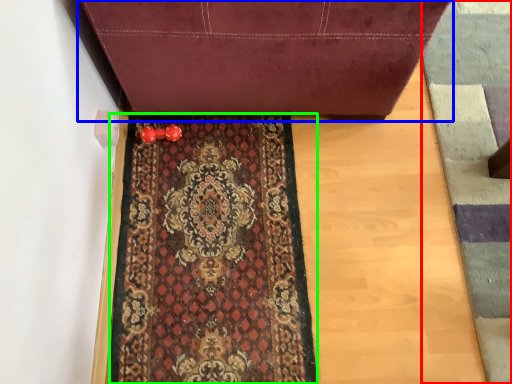
Question: Considering the real-world distances, which object is closest to doormat (highlighted by a red box)? furniture (highlighted by a blue box) or mat (highlighted by a green box).

Choices:
 (A) furniture
 (B) mat

Answer: (A)